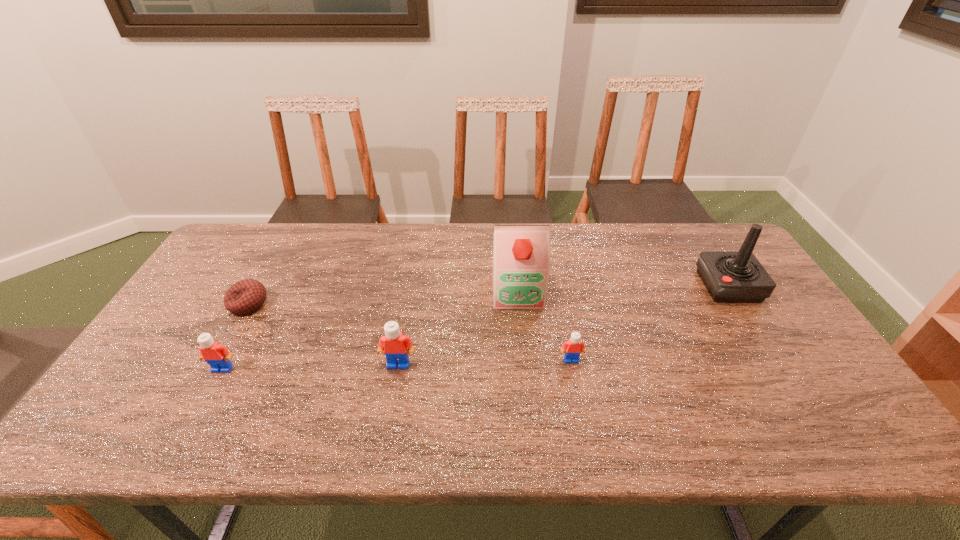
In the current image, all Legos are evenly spaced. To maintain this equal spacing, where should an additional Lego be placed on the right? Please point out a free spot. Please provide its 2D coordinates. Your answer should be formatted as a tuple, i.e. [(x, y)], where the tuple contains the x and y coordinates of a point satisfying the conditions above.

[(741, 355)]